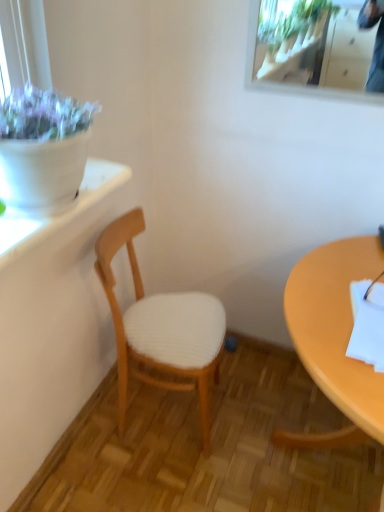
Question: From the image's perspective, is wooden chair at center on top of clear glass mirror at upper right?

Choices:
 (A) yes
 (B) no

Answer: (B)

Question: Is wooden chair at center next to clear glass mirror at upper right and touching it?

Choices:
 (A) yes
 (B) no

Answer: (B)

Question: Considering the relative sizes of wooden chair at center and clear glass mirror at upper right in the image provided, is wooden chair at center taller than clear glass mirror at upper right?

Choices:
 (A) no
 (B) yes

Answer: (B)

Question: Is wooden chair at center positioned far away from clear glass mirror at upper right?

Choices:
 (A) yes
 (B) no

Answer: (A)

Question: From the image's perspective, would you say wooden chair at center is shown under clear glass mirror at upper right?

Choices:
 (A) yes
 (B) no

Answer: (A)

Question: Is clear glass mirror at upper right a part of wooden chair at center?

Choices:
 (A) yes
 (B) no

Answer: (B)

Question: Is clear glass mirror at upper right closer to the viewer compared to matte yellow desk at right?

Choices:
 (A) no
 (B) yes

Answer: (A)

Question: Considering the relative sizes of clear glass mirror at upper right and matte yellow desk at right in the image provided, is clear glass mirror at upper right taller than matte yellow desk at right?

Choices:
 (A) no
 (B) yes

Answer: (A)

Question: Could you tell me if clear glass mirror at upper right is facing matte yellow desk at right?

Choices:
 (A) yes
 (B) no

Answer: (B)

Question: Is clear glass mirror at upper right shorter than matte yellow desk at right?

Choices:
 (A) yes
 (B) no

Answer: (A)

Question: From the image's perspective, would you say clear glass mirror at upper right is positioned over matte yellow desk at right?

Choices:
 (A) no
 (B) yes

Answer: (B)

Question: Considering the relative positions of clear glass mirror at upper right and matte yellow desk at right in the image provided, is clear glass mirror at upper right to the right of matte yellow desk at right from the viewer's perspective?

Choices:
 (A) no
 (B) yes

Answer: (A)

Question: Considering the relative sizes of matte yellow desk at right and wooden chair at center in the image provided, is matte yellow desk at right wider than wooden chair at center?

Choices:
 (A) no
 (B) yes

Answer: (B)